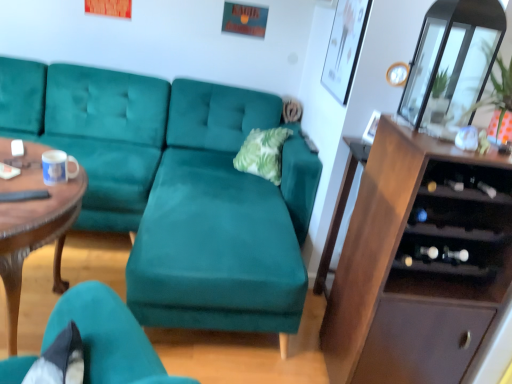
Find the location of `free spot in front of transparent glass door at upper right`. free spot in front of transparent glass door at upper right is located at coordinates (430, 144).